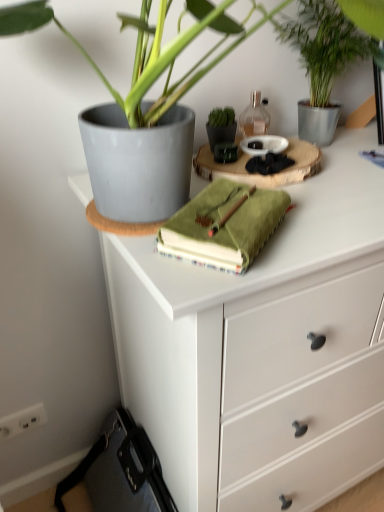
Identify the location of free point below green leafy plant at upper right (from a real-world perspective). (336, 146).